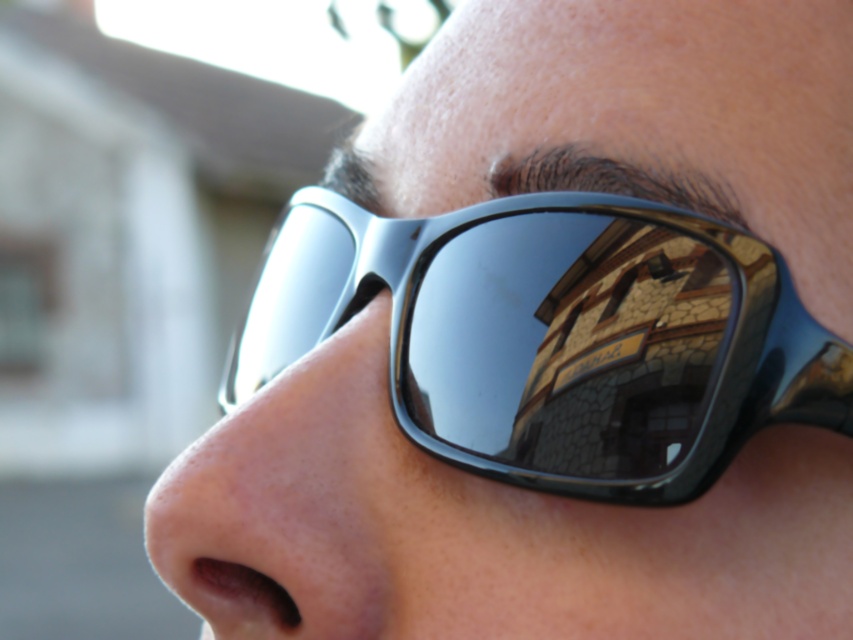
Which is above, black shiny sunglasses at center or matte skin nose at lower left?

black shiny sunglasses at center

Is point (573, 465) farther from viewer compared to point (277, 566)?

That is True.

Who is more forward, (419, 308) or (325, 435)?

Point (325, 435)

The width and height of the screenshot is (853, 640). Identify the location of black shiny sunglasses at center. (556, 336).